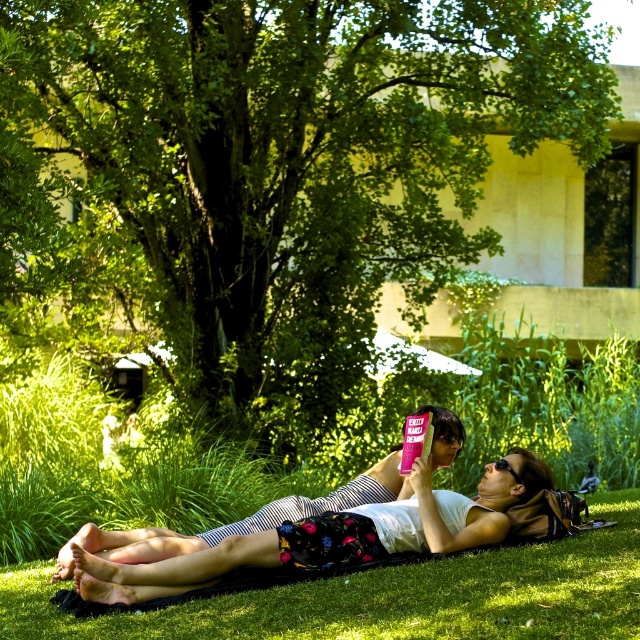
Can you confirm if green leafy tree at center is positioned above white cotton tank top at center?

Yes, green leafy tree at center is above white cotton tank top at center.

Does green leafy tree at center appear on the right side of white cotton tank top at center?

No, green leafy tree at center is not to the right of white cotton tank top at center.

Does point (540, 138) come behind point (292, 497)?

Yes, point (540, 138) is behind point (292, 497).

I want to click on green leafy tree at center, so click(x=280, y=168).

What do you see at coordinates (280, 168) in the screenshot? The height and width of the screenshot is (640, 640). I see `green leafy tree at center` at bounding box center [280, 168].

Can you confirm if green leafy tree at center is positioned below green grass at lower center?

Actually, green leafy tree at center is above green grass at lower center.

This screenshot has width=640, height=640. Find the location of `green leafy tree at center`. green leafy tree at center is located at coordinates (280, 168).

Which is behind, point (637, 550) or point (317, 502)?

Positioned behind is point (317, 502).

Is point (625, 561) closer to viewer compared to point (138, 557)?

Yes, it is.

At what (x,y) coordinates should I click in order to perform the action: click on green grass at lower center. Please return your answer as a coordinate pair (x, y). The height and width of the screenshot is (640, 640). Looking at the image, I should click on (394, 596).